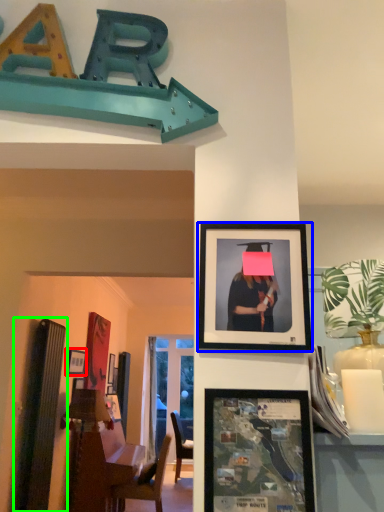
Question: Considering the real-world distances, which object is farthest from picture frame (highlighted by a red box)? picture frame (highlighted by a blue box) or bulletin board (highlighted by a green box)?

Choices:
 (A) picture frame
 (B) bulletin board

Answer: (A)